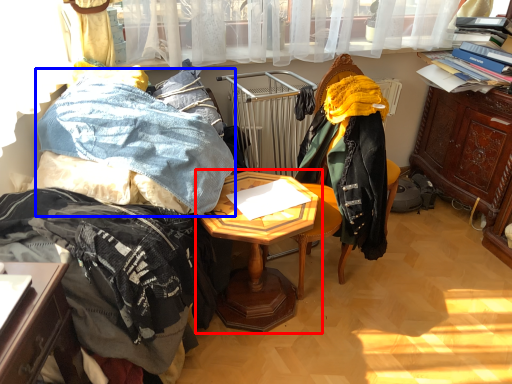
Question: Which object is closer to the camera taking this photo, table (highlighted by a red box) or clothing (highlighted by a blue box)?

Choices:
 (A) table
 (B) clothing

Answer: (B)